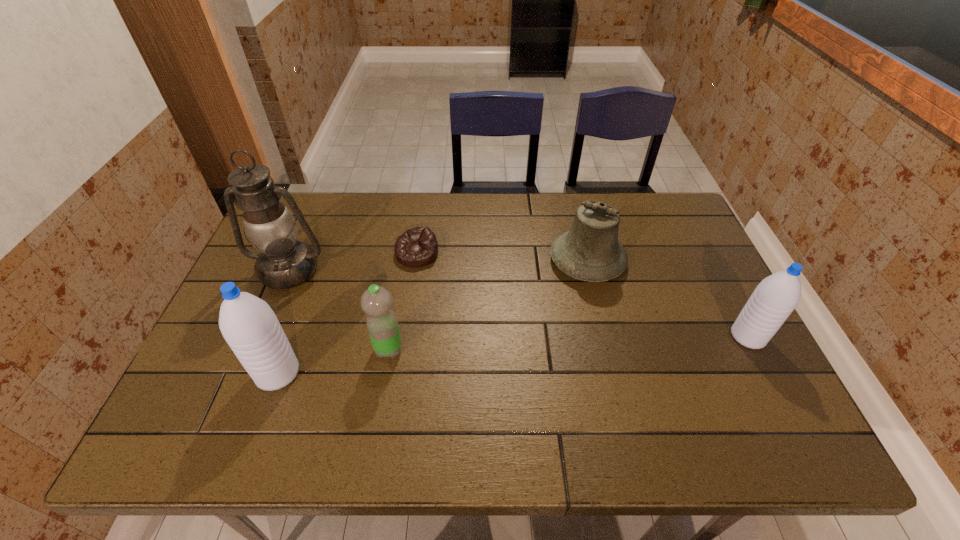
The width and height of the screenshot is (960, 540). Identify the location of the tallest water bottle. (248, 324).

Where is `the fifth shortest object`? The height and width of the screenshot is (540, 960). the fifth shortest object is located at coordinates (248, 324).

Locate an element on the screen. the rightmost object is located at coordinates (776, 296).

Find the location of `the shortest object`. the shortest object is located at coordinates (416, 247).

At what (x,y) coordinates should I click in order to perform the action: click on bell. Please return your answer as a coordinate pair (x, y). The image size is (960, 540). Looking at the image, I should click on (590, 251).

This screenshot has height=540, width=960. What are the coordinates of `oil lamp` in the screenshot? It's located at (284, 262).

Identify the location of the second water bottle from right to left. The height and width of the screenshot is (540, 960). (382, 324).

Locate an element on the screen. The image size is (960, 540). vacant space located 0.310m on the right of the tallest water bottle is located at coordinates (431, 373).

The width and height of the screenshot is (960, 540). I want to click on blank space located on the back of the rightmost object, so click(731, 303).

Image resolution: width=960 pixels, height=540 pixels. Identify the location of free space located 0.250m on the right of the shortest object. (521, 254).